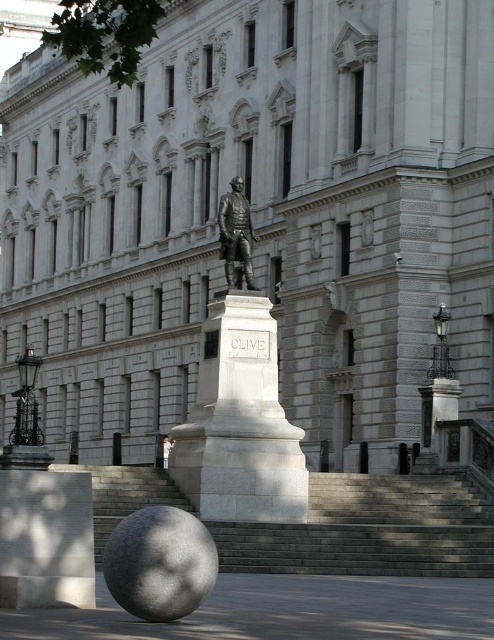
Based on the photo, how far apart are bronze statue at center and white marble statue at center?

bronze statue at center is 18.19 meters away from white marble statue at center.

Which is in front, point (238, 196) or point (164, 467)?

Point (238, 196) is in front.

Which is behind, point (239, 205) or point (173, 442)?

Point (173, 442)

Identify the location of bronze statue at center. (236, 234).

Where is `gray stone stairs at center`? This screenshot has height=640, width=494. gray stone stairs at center is located at coordinates (370, 531).

Is gray stone stairs at center positioned at the back of polished bronze statue at center?

No, gray stone stairs at center is closer to the viewer.

This screenshot has height=640, width=494. In order to click on gray stone stairs at center in this screenshot , I will do `click(370, 531)`.

How distant is gray stone stairs at center from bronze statue at center?

The distance of gray stone stairs at center from bronze statue at center is 10.36 meters.

Is point (166, 483) farther from viewer compared to point (236, 240)?

No, it is not.

Between point (344, 484) and point (242, 269), which one is positioned behind?

Point (344, 484)

Image resolution: width=494 pixels, height=640 pixels. Identify the location of gray stone stairs at center. (370, 531).